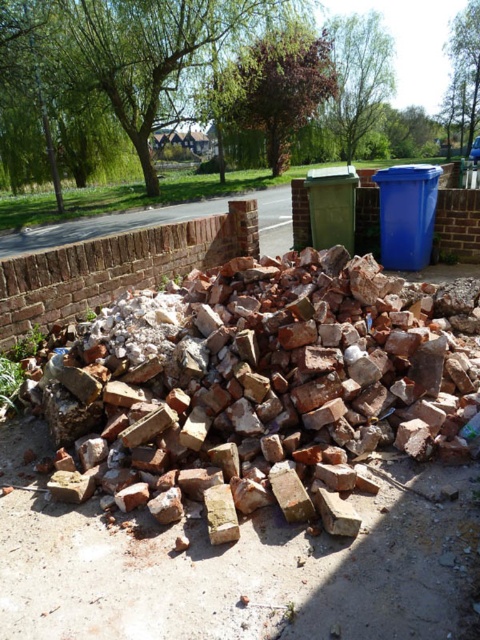
You are standing in front of the pile of broken bricks and notice two points marked on the ground. The first point is at coordinates point (429, 177) and the second is at point (336, 189). Which point is closer to your current position?

Point (429, 177) is closer to the camera than point (336, 189), so it is closer to your current position.

You are standing at the point labeled point (x=324, y=204) and want to walk to the point labeled point (x=268, y=392). Which direction should you move to get closer to your destination?

You should move forward because point (x=268, y=392) is in front of point (x=324, y=204).

You are a gardener who needs to move the green plastic bin at center to access the brown rough bricks at center. Based on the scene description, can you lift the bin directly without moving any bricks first?

The brown rough bricks at center is located below the green plastic bin at center, so you can lift the green plastic bin at center directly without moving any bricks first since it is positioned above them.